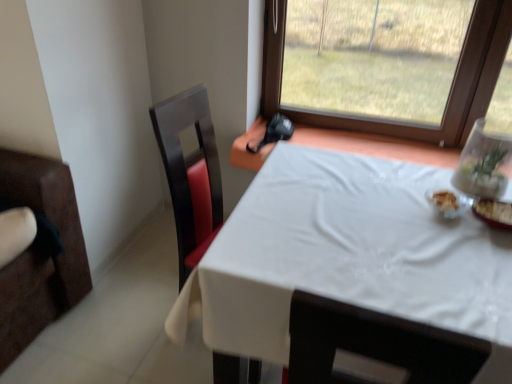
In order to click on transparent glass vase at upper right in this screenshot , I will do `click(484, 164)`.

The image size is (512, 384). Find the location of `matte black swivel chair at left`. matte black swivel chair at left is located at coordinates (190, 174).

Where is `white glossy bowl at upper right`? This screenshot has height=384, width=512. white glossy bowl at upper right is located at coordinates click(447, 202).

From the image's perspective, is white glossy bowl at upper right over transparent glass vase at upper right?

Actually, white glossy bowl at upper right appears below transparent glass vase at upper right in the image.

Would you say white glossy bowl at upper right is a long distance from transparent glass vase at upper right?

They are positioned close to each other.

Is white glossy bowl at upper right oriented away from transparent glass vase at upper right?

No, transparent glass vase at upper right is not at the back of white glossy bowl at upper right.

Which is behind, white cloth-covered table at center or transparent glass vase at upper right?

transparent glass vase at upper right is behind.

Considering the sizes of objects white cloth-covered table at center and transparent glass vase at upper right in the image provided, who is smaller, white cloth-covered table at center or transparent glass vase at upper right?

Smaller between the two is transparent glass vase at upper right.

From the image's perspective, which is below, white cloth-covered table at center or transparent glass vase at upper right?

white cloth-covered table at center is shown below in the image.

Considering the sizes of objects white cloth-covered table at center and transparent glass vase at upper right in the image provided, who is taller, white cloth-covered table at center or transparent glass vase at upper right?

With more height is white cloth-covered table at center.

Is matte black swivel chair at left facing away from transparent glass vase at upper right?

No.

Is matte black swivel chair at left outside of transparent glass vase at upper right?

Absolutely, matte black swivel chair at left is external to transparent glass vase at upper right.

Are matte black swivel chair at left and transparent glass vase at upper right far apart?

matte black swivel chair at left is actually quite close to transparent glass vase at upper right.

From a real-world perspective, which is physically above, matte black swivel chair at left or transparent glass vase at upper right?

transparent glass vase at upper right, from a real-world perspective.

Would you say matte black swivel chair at left is a long distance from white glossy bowl at upper right?

No, matte black swivel chair at left is not far away from white glossy bowl at upper right.

Which object is positioned more to the left, matte black swivel chair at left or white glossy bowl at upper right?

matte black swivel chair at left.

From the image's perspective, relative to white glossy bowl at upper right, is matte black swivel chair at left above or below?

matte black swivel chair at left is below white glossy bowl at upper right.

What's the angular difference between matte black swivel chair at left and white glossy bowl at upper right's facing directions?

The angle between the facing direction of matte black swivel chair at left and the facing direction of white glossy bowl at upper right is 80.6 degrees.

From the image's perspective, is white cloth-covered table at center above matte black swivel chair at left?

No, from the image's perspective, white cloth-covered table at center is not above matte black swivel chair at left.

The width and height of the screenshot is (512, 384). Identify the location of swivel chair above the white cloth-covered table at center (from a real-world perspective). (190, 174).

Would you consider white cloth-covered table at center to be distant from matte black swivel chair at left?

white cloth-covered table at center is near matte black swivel chair at left, not far away.

From a real-world perspective, is transparent glass vase at upper right above or below white cloth-covered table at center?

Clearly, from a real-world perspective, transparent glass vase at upper right is above white cloth-covered table at center.

Is the depth of transparent glass vase at upper right less than that of white cloth-covered table at center?

No, transparent glass vase at upper right is further to the viewer.

This screenshot has width=512, height=384. I want to click on table below the transparent glass vase at upper right (from a real-world perspective), so [x=352, y=255].

Do you think transparent glass vase at upper right is within white cloth-covered table at center, or outside of it?

transparent glass vase at upper right is not enclosed by white cloth-covered table at center.

Identify the location of tableware above the white cloth-covered table at center (from the image's perspective). This screenshot has height=384, width=512. (447, 202).

From a real-world perspective, relative to white cloth-covered table at center, is white glossy bowl at upper right vertically above or below?

white glossy bowl at upper right is above white cloth-covered table at center.

Can you confirm if white glossy bowl at upper right is thinner than white cloth-covered table at center?

Indeed, white glossy bowl at upper right has a lesser width compared to white cloth-covered table at center.

Locate an element on the screen. tableware located underneath the transparent glass vase at upper right (from a real-world perspective) is located at coordinates (447, 202).

You are a GUI agent. You are given a task and a screenshot of the screen. Output one action in this format:
    pyautogui.click(x=<x>, y=<y>)
    Task: Click on the glass vase that appears on the right of white cloth-covered table at center
    Image resolution: width=512 pixels, height=384 pixels.
    Given the screenshot: What is the action you would take?
    pyautogui.click(x=484, y=164)

Considering their positions, is white cloth-covered table at center positioned further to transparent glass vase at upper right than matte black swivel chair at left?

Based on the image, matte black swivel chair at left appears to be further to transparent glass vase at upper right.

From the image, which object appears to be nearer to matte black swivel chair at left, white glossy bowl at upper right or white cloth-covered table at center?

white cloth-covered table at center is closer to matte black swivel chair at left.

Based on their spatial positions, is transparent glass vase at upper right or matte black swivel chair at left further from white glossy bowl at upper right?

Among the two, matte black swivel chair at left is located further to white glossy bowl at upper right.

Looking at the image, which one is located further to white cloth-covered table at center, transparent glass vase at upper right or white glossy bowl at upper right?

The object further to white cloth-covered table at center is transparent glass vase at upper right.

Which object lies nearer to the anchor point matte black swivel chair at left, transparent glass vase at upper right or white glossy bowl at upper right?

white glossy bowl at upper right lies closer to matte black swivel chair at left than the other object.

Considering their positions, is white cloth-covered table at center positioned further to white glossy bowl at upper right than transparent glass vase at upper right?

white cloth-covered table at center is further to white glossy bowl at upper right.

When comparing their distances from transparent glass vase at upper right, does white cloth-covered table at center or white glossy bowl at upper right seem further?

Among the two, white cloth-covered table at center is located further to transparent glass vase at upper right.

Looking at the image, which one is located further to white cloth-covered table at center, matte black swivel chair at left or white glossy bowl at upper right?

Among the two, matte black swivel chair at left is located further to white cloth-covered table at center.

Where is `table between matte black swivel chair at left and white glossy bowl at upper right from left to right`? This screenshot has width=512, height=384. table between matte black swivel chair at left and white glossy bowl at upper right from left to right is located at coordinates (352, 255).

At what (x,y) coordinates should I click in order to perform the action: click on glass vase located between white cloth-covered table at center and white glossy bowl at upper right in the depth direction. Please return your answer as a coordinate pair (x, y). This screenshot has height=384, width=512. Looking at the image, I should click on (484, 164).

Identify the location of tableware between matte black swivel chair at left and transparent glass vase at upper right from left to right. This screenshot has width=512, height=384. (447, 202).

Find the location of a particular element. table between matte black swivel chair at left and transparent glass vase at upper right is located at coordinates (352, 255).